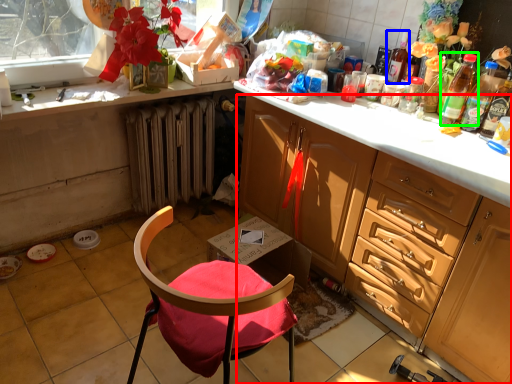
Question: Based on their relative distances, which object is farther from cabinetry (highlighted by a red box)? Choose from bottle (highlighted by a blue box) and bottle (highlighted by a green box).

Choices:
 (A) bottle
 (B) bottle

Answer: (A)